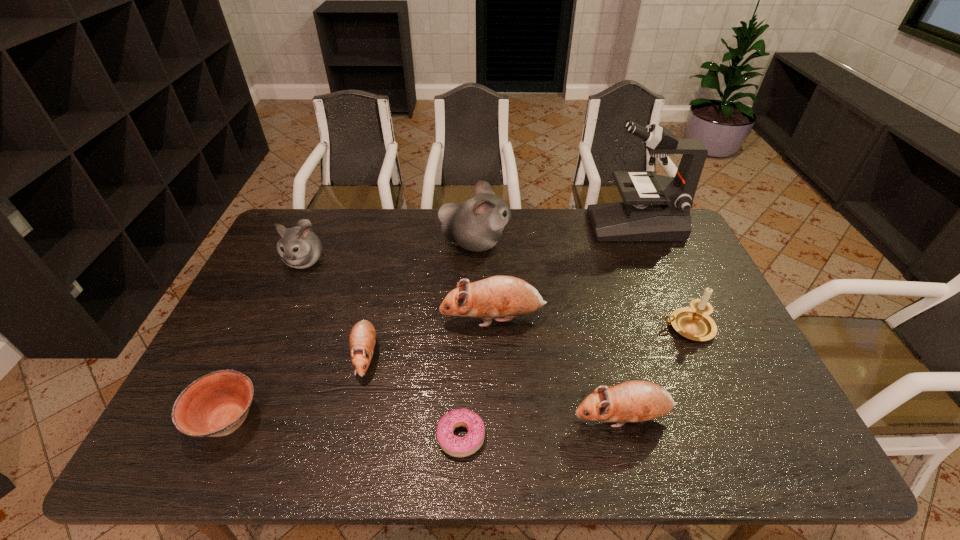
At what (x,y) coordinates should I click in order to perform the action: click on the tallest object. Please return your answer as a coordinate pair (x, y). Image resolution: width=960 pixels, height=540 pixels. Looking at the image, I should click on (658, 209).

What are the coordinates of `the tallest hamster` in the screenshot? It's located at (476, 225).

Where is `the right white hamster`? The image size is (960, 540). the right white hamster is located at coordinates (476, 225).

In order to click on the left white hamster in this screenshot , I will do `click(299, 247)`.

At what (x,y) coordinates should I click in order to perform the action: click on the smaller white hamster. Please return your answer as a coordinate pair (x, y). Looking at the image, I should click on (299, 247).

The width and height of the screenshot is (960, 540). Find the location of `the second brown hamster from right to left`. the second brown hamster from right to left is located at coordinates (498, 296).

Identify the location of candle holder. This screenshot has height=540, width=960. (694, 323).

The width and height of the screenshot is (960, 540). In order to click on the nearest hamster in this screenshot , I will do `click(633, 401)`.

Locate an element on the screen. Image resolution: width=960 pixels, height=540 pixels. the fourth tallest hamster is located at coordinates (633, 401).

I want to click on the third object from left to right, so click(x=362, y=339).